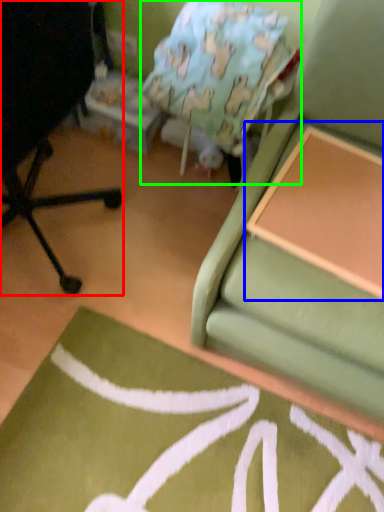
Question: Which object is positioned farthest from chair (highlighted by a red box)? Select from table (highlighted by a blue box) and bean bag chair (highlighted by a green box).

Choices:
 (A) table
 (B) bean bag chair

Answer: (A)